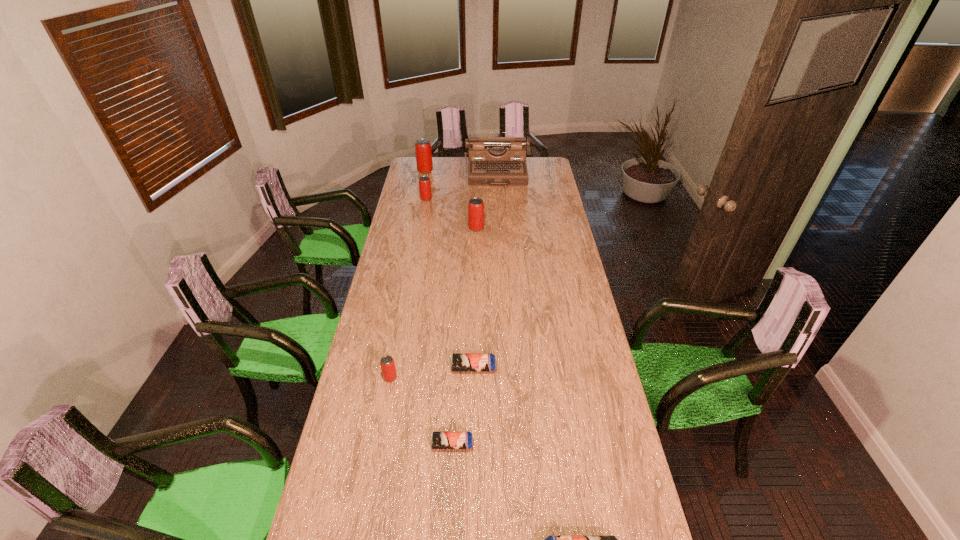
You are a GUI agent. You are given a task and a screenshot of the screen. Output one action in this format:
    pyautogui.click(x=<x>, y=<y>)
    Task: Click on the fifth closest beer can relative to the second nearest beer can
    The width and height of the screenshot is (960, 540).
    Given the screenshot: What is the action you would take?
    pyautogui.click(x=424, y=182)

Find the location of a particular element. Image resolution: width=960 pixels, height=540 pixels. pink beer can that is the third nearest to the fifth nearest beer can is located at coordinates (387, 364).

Identify the location of the closest pink beer can relative to the second nearest blue beer can. (387, 364).

Locate which blue beer can ranks in proximity to the sixth farthest beer can. Please provide its 2D coordinates. Your answer should be formatted as a tuple, i.e. [(x, y)], where the tuple contains the x and y coordinates of a point satisfying the conditions above.

[(459, 362)]

Identify which blue beer can is located as the third nearest to the fifth tallest object. Please provide its 2D coordinates. Your answer should be formatted as a tuple, i.e. [(x, y)], where the tuple contains the x and y coordinates of a point satisfying the conditions above.

[(550, 539)]

Locate an element on the screen. This screenshot has height=540, width=960. vacant area that satisfies the following two spatial constraints: 1. on the back side of the nearest pink beer can; 2. on the left side of the sixth nearest object is located at coordinates (423, 199).